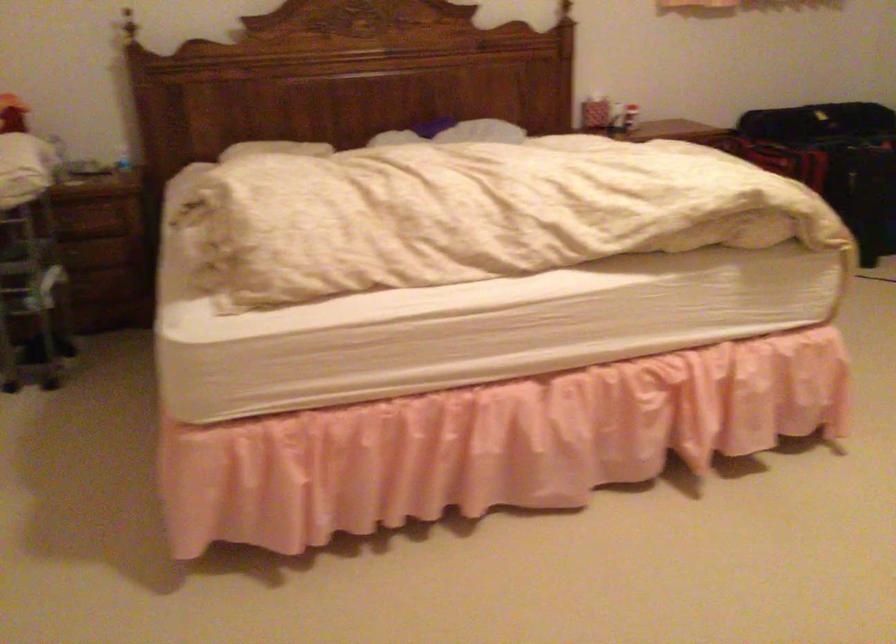
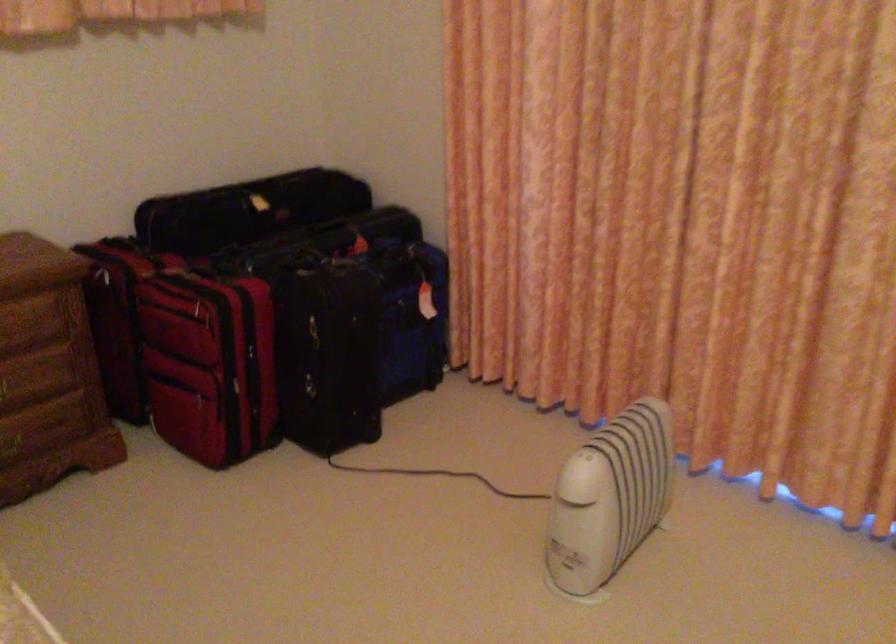
In the second image, find the point that corresponds to point (814, 131) in the first image.

(243, 292)